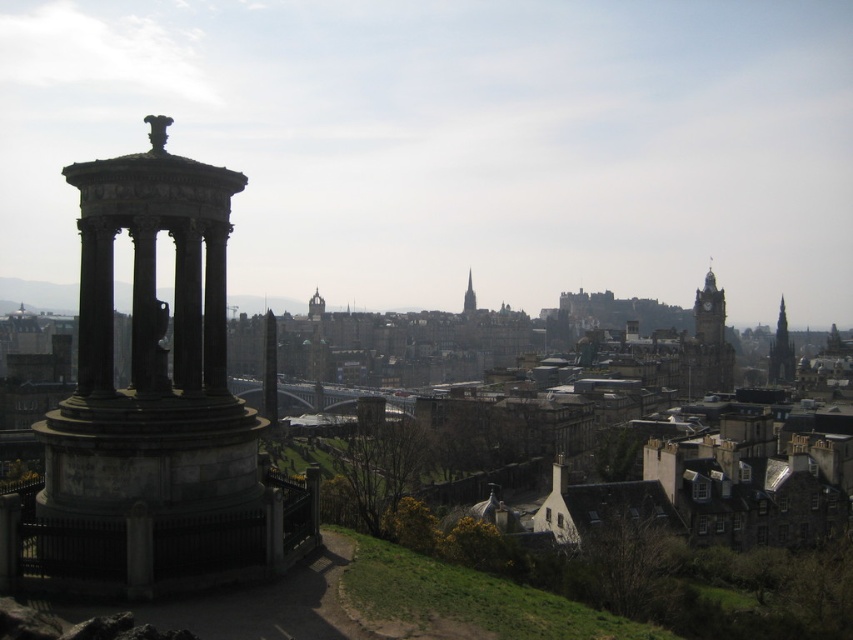
Which is more to the left, gray stone column at left or smooth stone tower at center?

smooth stone tower at center

Does point (225, 237) lie behind point (317, 305)?

No.

This screenshot has width=853, height=640. In order to click on gray stone column at left in this screenshot , I will do `click(154, 388)`.

In the scene shown: Which of these two, matte stone clock tower at upper right or smooth stone spire at center, stands shorter?

Standing shorter between the two is smooth stone spire at center.

Where is `matte stone clock tower at upper right`? matte stone clock tower at upper right is located at coordinates (709, 310).

Describe the element at coordinates (709, 310) in the screenshot. I see `matte stone clock tower at upper right` at that location.

Identify the location of matte stone clock tower at upper right. The width and height of the screenshot is (853, 640). coord(709,310).

Can you confirm if matte stone clock tower at upper right is bigger than smooth stone tower at center?

Yes.

Find the location of a particular element. Image resolution: width=853 pixels, height=640 pixels. matte stone clock tower at upper right is located at coordinates (709, 310).

Identify the location of matte stone clock tower at upper right. (709, 310).